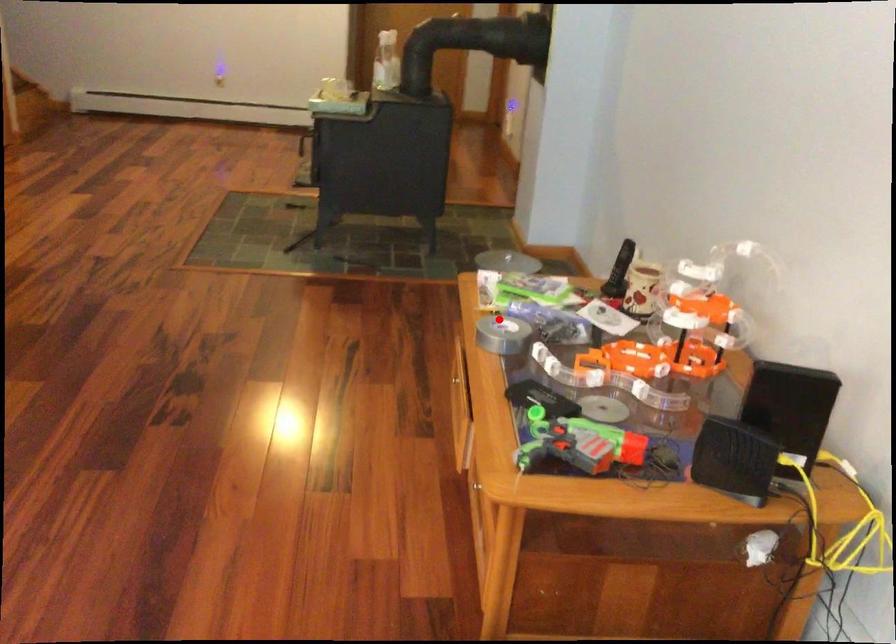
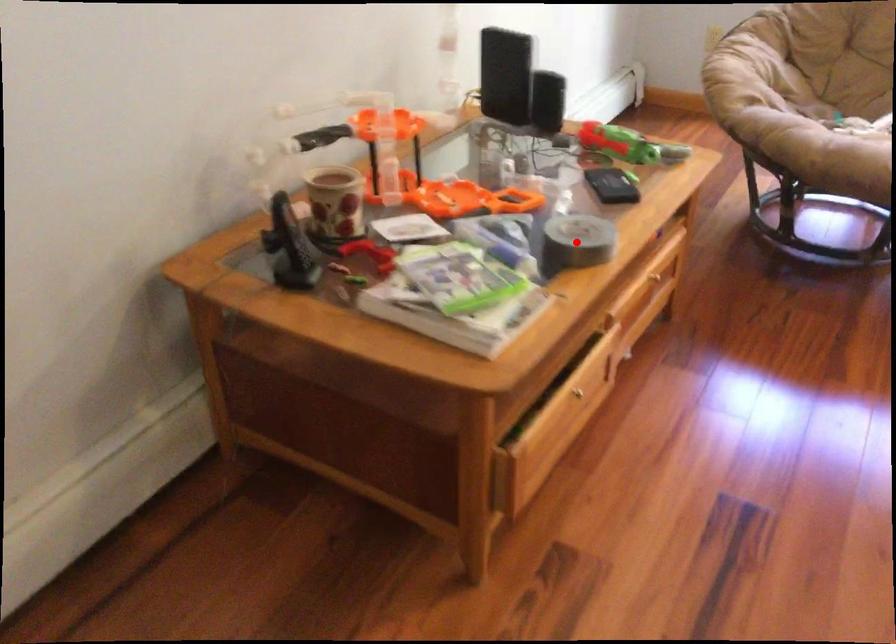
I am providing you with two images of the same scene from different viewpoints. A red point is marked on the first image and another point is marked on the second image. Do the highlighted points in image1 and image2 indicate the same real-world spot?

Yes